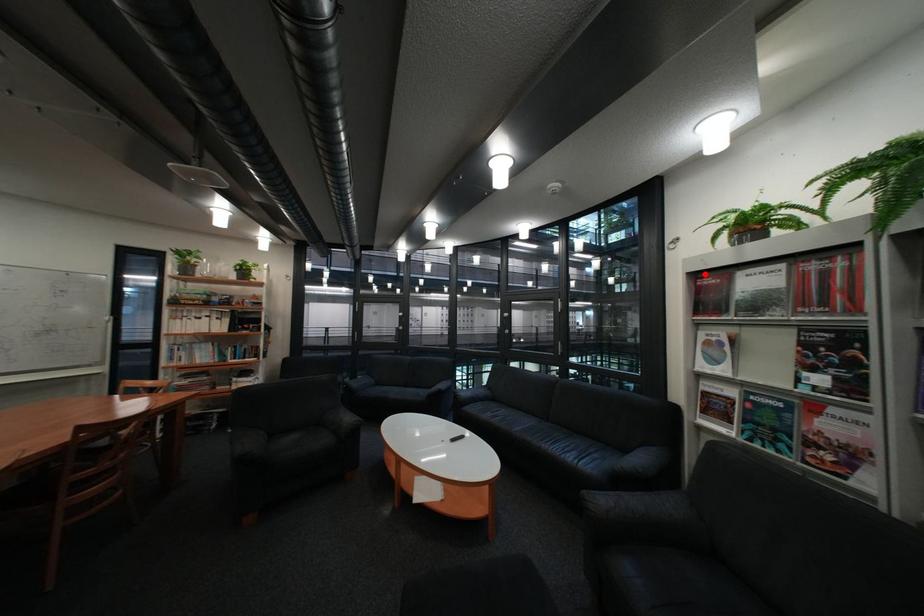
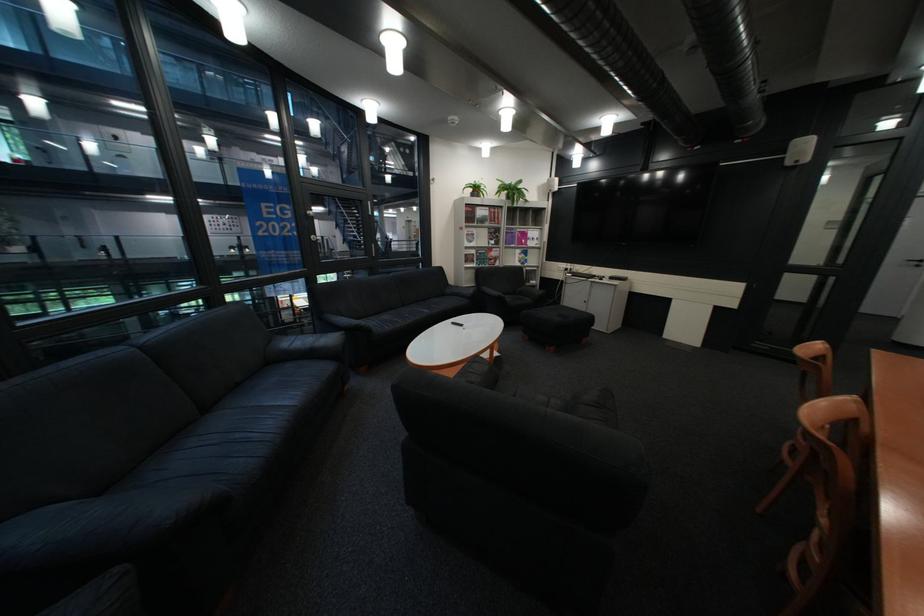
Locate, in the second image, the point that corresponds to the highlighted location in the first image.

(481, 205)